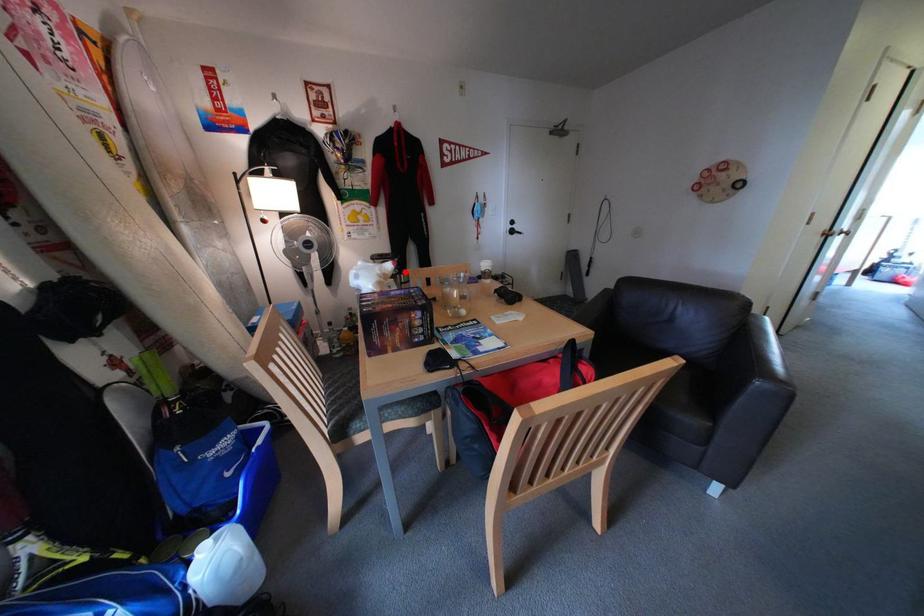
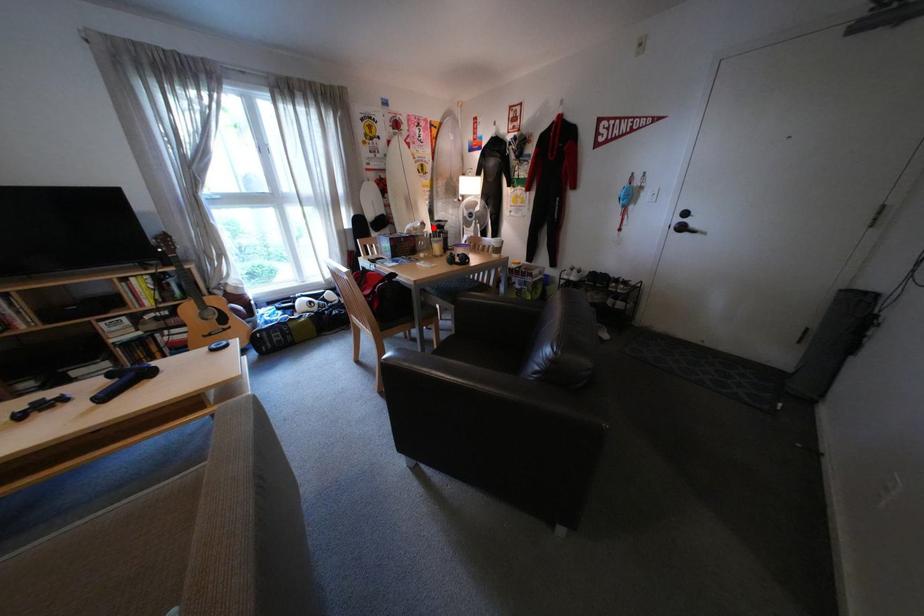
I am providing you with two images of the same scene from different viewpoints. A red point is marked on the first image and another point is marked on the second image. Is the marked point in image1 the same physical position as the marked point in image2?

Yes